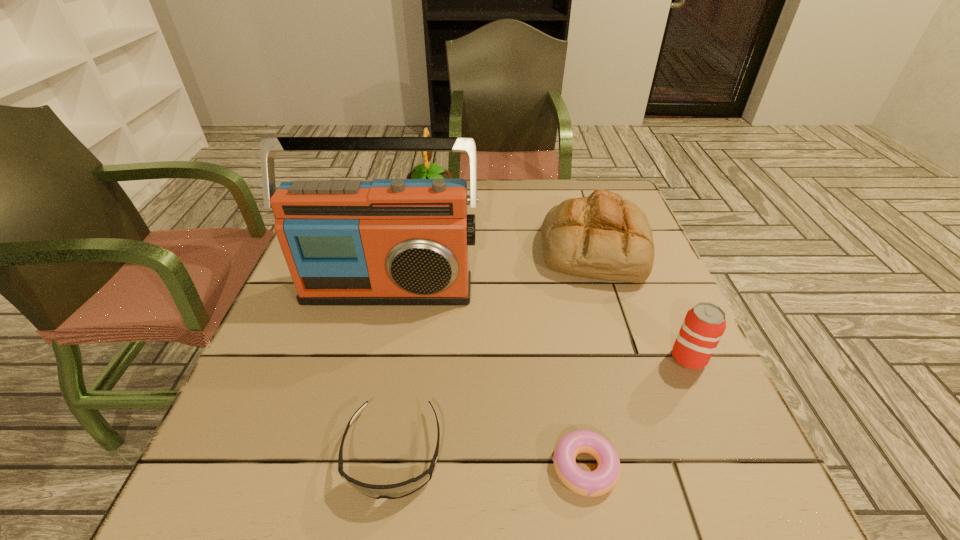
I want to click on vacant area that lies between the doughnut and the second shortest object, so click(489, 460).

Locate an element on the screen. free point between the bread and the beer can is located at coordinates (642, 303).

Where is `free space between the fourth farthest object and the second shortest object`? free space between the fourth farthest object and the second shortest object is located at coordinates (540, 406).

The height and width of the screenshot is (540, 960). I want to click on unoccupied area between the beer can and the doughnut, so click(636, 413).

Where is `object that is the closest to the radio receiver`? object that is the closest to the radio receiver is located at coordinates (602, 236).

Locate an element on the screen. The width and height of the screenshot is (960, 540). object that can be found as the fifth closest to the farthest object is located at coordinates tap(600, 481).

Identify the location of vacant area that satisfies the following two spatial constraints: 1. on the face of the second tallest object; 2. on the right side of the doughnut. The height and width of the screenshot is (540, 960). (385, 467).

The width and height of the screenshot is (960, 540). In order to click on blank area in the image that satisfies the following two spatial constraints: 1. on the front-facing side of the tallest object; 2. on the right side of the shortest object in this screenshot , I will do `click(347, 467)`.

This screenshot has width=960, height=540. I want to click on free space that satisfies the following two spatial constraints: 1. on the face of the bread; 2. on the right side of the sunflower, so click(421, 248).

Identify the location of free location that satisfies the following two spatial constraints: 1. on the face of the fifth shortest object; 2. on the right side of the beer can. click(x=403, y=359).